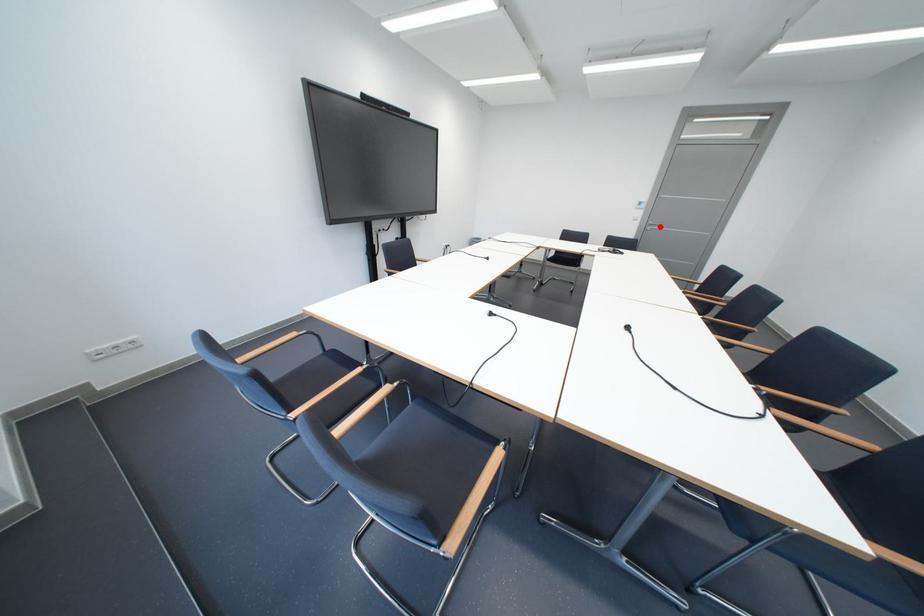
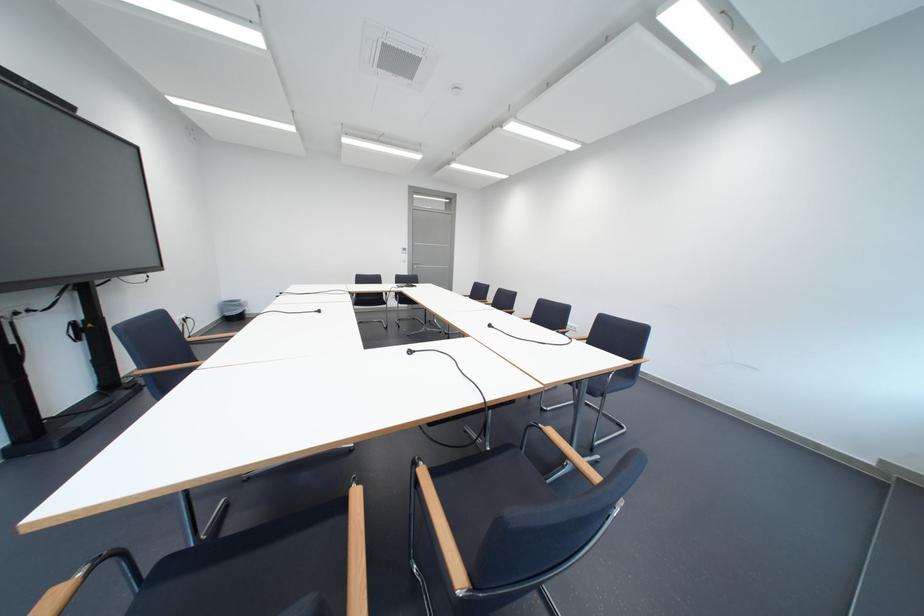
Question: I am providing you with two images of the same scene from different viewpoints. A red point is shown in image1. For the corresponding object point in image2, is it positioned nearer or farther from the camera?

Choices:
 (A) Nearer
 (B) Farther

Answer: (A)